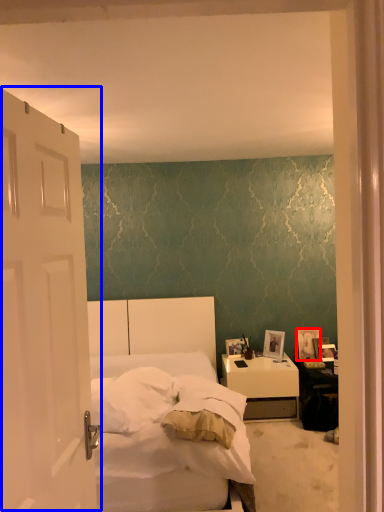
Question: Among these objects, which one is farthest to the camera, picture frame (highlighted by a red box) or door (highlighted by a blue box)?

Choices:
 (A) picture frame
 (B) door

Answer: (A)